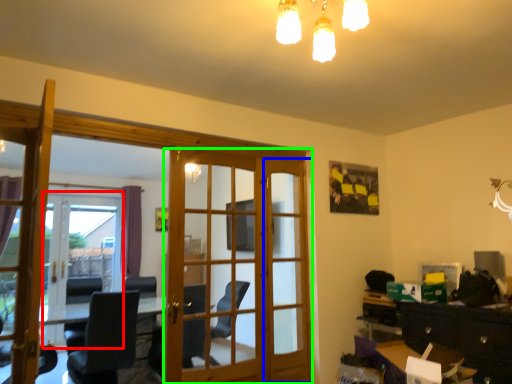
Question: Which object is positioned farthest from screen door (highlighted by a red box)? Select from screen door (highlighted by a blue box) and door (highlighted by a green box).

Choices:
 (A) screen door
 (B) door

Answer: (B)